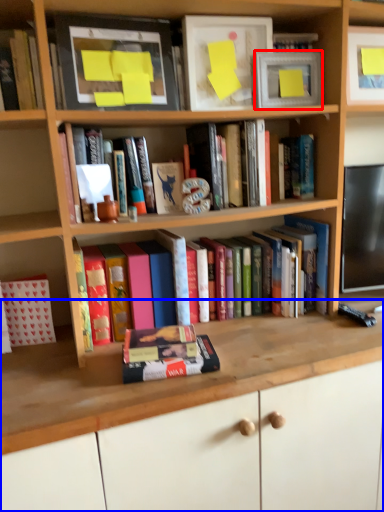
Question: Which object appears farthest to the camera in this image, picture frame (highlighted by a red box) or computer desk (highlighted by a blue box)?

Choices:
 (A) picture frame
 (B) computer desk

Answer: (A)